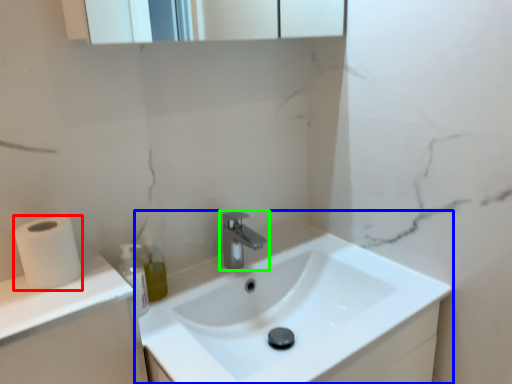
Question: Considering the real-world distances, which object is farthest from toilet paper (highlighted by a red box)? sink (highlighted by a blue box) or tap (highlighted by a green box)?

Choices:
 (A) sink
 (B) tap

Answer: (A)